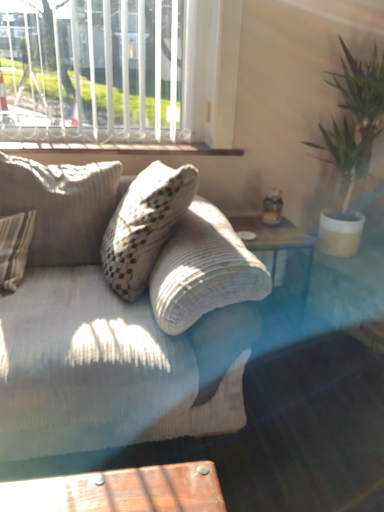
Measure the distance between white painted wood at upper center and camera.

The distance of white painted wood at upper center from camera is 1.95 meters.

Where is `transparent glass plate at upper right`? transparent glass plate at upper right is located at coordinates (246, 234).

Does white painted wood at upper center turn towards green leafy plant at right?

No, white painted wood at upper center is not aimed at green leafy plant at right.

From the image's perspective, which is above, white painted wood at upper center or green leafy plant at right?

white painted wood at upper center is shown above in the image.

Considering the relative positions of white painted wood at upper center and green leafy plant at right in the image provided, is white painted wood at upper center in front of green leafy plant at right?

No, white painted wood at upper center is further to the viewer.

How different are the orientations of green leafy plant at right and white textured window at upper left in degrees?

green leafy plant at right and white textured window at upper left are facing 0.518 degrees away from each other.

Are green leafy plant at right and white textured window at upper left beside each other?

No, green leafy plant at right is not with white textured window at upper left.

Is green leafy plant at right shorter than white textured window at upper left?

Incorrect, the height of green leafy plant at right does not fall short of that of white textured window at upper left.

Relative to white textured window at upper left, is textured beige pillow at left in front or behind?

In the image, textured beige pillow at left appears in front of white textured window at upper left.

Is textured beige pillow at left with white textured window at upper left?

There is a gap between textured beige pillow at left and white textured window at upper left.

How different are the orientations of textured beige pillow at left and white textured window at upper left in degrees?

The angular difference between textured beige pillow at left and white textured window at upper left is 6.33 degrees.

From the image's perspective, is textured beige pillow at left under white textured window at upper left?

Yes, from the image's perspective, textured beige pillow at left is below white textured window at upper left.

Is clear glass table at center located within transparent glass plate at upper right?

No, clear glass table at center is not inside transparent glass plate at upper right.

Relative to clear glass table at center, is transparent glass plate at upper right in front or behind?

Clearly, transparent glass plate at upper right is behind clear glass table at center.

Considering the sizes of objects transparent glass plate at upper right and clear glass table at center in the image provided, who is wider, transparent glass plate at upper right or clear glass table at center?

With larger width is clear glass table at center.

How much distance is there between transparent glass plate at upper right and clear glass table at center?

A distance of 27.15 centimeters exists between transparent glass plate at upper right and clear glass table at center.

Is transparent glass plate at upper right inside clear glass table at center?

Yes, transparent glass plate at upper right can be found within clear glass table at center.

Is clear glass table at center directly adjacent to transparent glass plate at upper right?

clear glass table at center is not next to transparent glass plate at upper right, and they're not touching.

Based on the photo, is clear glass table at center turned away from transparent glass plate at upper right?

No, clear glass table at center is not facing away from transparent glass plate at upper right.

Is clear glass table at center wider or thinner than transparent glass plate at upper right?

In the image, clear glass table at center appears to be wider than transparent glass plate at upper right.

Which is correct: transparent glass plate at upper right is inside green leafy plant at right, or outside of it?

transparent glass plate at upper right is outside green leafy plant at right.

In the scene shown: Would you say transparent glass plate at upper right is a long distance from green leafy plant at right?

Actually, transparent glass plate at upper right and green leafy plant at right are a little close together.

Can you confirm if transparent glass plate at upper right is shorter than green leafy plant at right?

Indeed, transparent glass plate at upper right has a lesser height compared to green leafy plant at right.

Measure the distance between transparent glass plate at upper right and green leafy plant at right.

They are 26.30 inches apart.

Which object is further away from the camera taking this photo, textured beige pillow at left or white painted wood at upper center?

white painted wood at upper center is behind.

Can you see textured beige pillow at left touching white painted wood at upper center?

There is a gap between textured beige pillow at left and white painted wood at upper center.

Is textured beige pillow at left wider than white painted wood at upper center?

Correct, the width of textured beige pillow at left exceeds that of white painted wood at upper center.

Find the location of a particular element. houseplant on the right of white painted wood at upper center is located at coordinates (351, 146).

The height and width of the screenshot is (512, 384). What are the coordinates of `houseplant located in front of the white textured window at upper left` in the screenshot? It's located at (351, 146).

Which object lies nearer to the anchor point white textured window at upper left, clear glass table at center or textured beige pillow at left?

textured beige pillow at left is closer to white textured window at upper left.

Looking at this image, estimate the real-world distances between objects in this image. Which object is further from white textured window at upper left, clear glass table at center or transparent glass plate at upper right?

The object further to white textured window at upper left is transparent glass plate at upper right.

From the image, which object appears to be nearer to textured beige pillow at left, white textured window at upper left or transparent glass plate at upper right?

Among the two, white textured window at upper left is located nearer to textured beige pillow at left.

Looking at the image, which one is located closer to green leafy plant at right, white textured window at upper left or white painted wood at upper center?

white painted wood at upper center lies closer to green leafy plant at right than the other object.

When comparing their distances from white painted wood at upper center, does white textured window at upper left or transparent glass plate at upper right seem further?

The object further to white painted wood at upper center is transparent glass plate at upper right.

Based on the photo, when comparing their distances from textured beige pillow at left, does white painted wood at upper center or green leafy plant at right seem closer?

Based on the image, white painted wood at upper center appears to be nearer to textured beige pillow at left.

Estimate the real-world distances between objects in this image. Which object is closer to white painted wood at upper center, green leafy plant at right or white textured window at upper left?

white textured window at upper left lies closer to white painted wood at upper center than the other object.

Based on their spatial positions, is green leafy plant at right or white painted wood at upper center closer to transparent glass plate at upper right?

The object closer to transparent glass plate at upper right is green leafy plant at right.

Find the location of `table between textured beige pillow at left and green leafy plant at right from left to right`. table between textured beige pillow at left and green leafy plant at right from left to right is located at coordinates (277, 244).

This screenshot has height=512, width=384. I want to click on window sill between white textured window at upper left and textured beige pillow at left in the vertical direction, so click(117, 148).

The image size is (384, 512). In order to click on table between white textured window at upper left and green leafy plant at right in this screenshot , I will do `click(277, 244)`.

I want to click on table between white painted wood at upper center and green leafy plant at right from left to right, so click(277, 244).